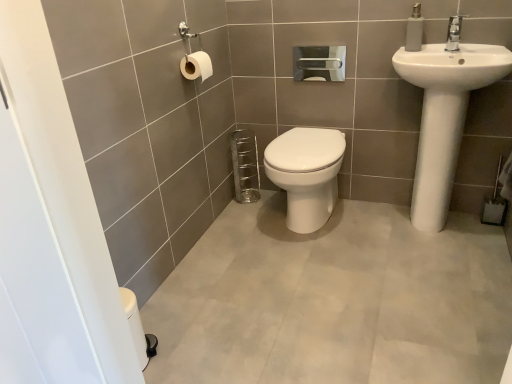
At what (x,y) coordinates should I click in order to perform the action: click on vacant area that lies in front of white matte soap dispenser at upper right. Please return your answer as a coordinate pair (x, y). The image size is (512, 384). Looking at the image, I should click on (429, 52).